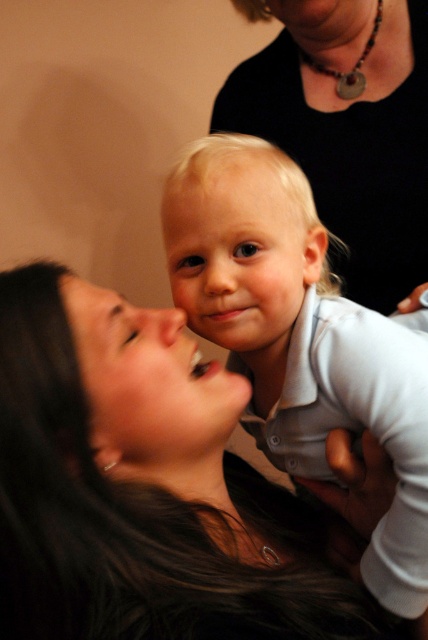
How far apart are blonde hair at center and black matte shirt at upper center?

blonde hair at center and black matte shirt at upper center are 14.57 inches apart from each other.

You are a GUI agent. You are given a task and a screenshot of the screen. Output one action in this format:
    pyautogui.click(x=<x>, y=<y>)
    Task: Click on the blonde hair at center
    The image size is (428, 640).
    Given the screenshot: What is the action you would take?
    pyautogui.click(x=300, y=337)

Who is more forward, [315,376] or [366,216]?

Point [315,376] is in front.

Where is `blonde hair at center`? Image resolution: width=428 pixels, height=640 pixels. blonde hair at center is located at coordinates (300, 337).

Can you confirm if smooth black hair at center is wider than black matte shirt at upper center?

Correct, the width of smooth black hair at center exceeds that of black matte shirt at upper center.

Who is positioned more to the left, smooth black hair at center or black matte shirt at upper center?

smooth black hair at center

Is point (259, 504) in front of point (247, 112)?

Yes, it is in front of point (247, 112).

At what (x,y) coordinates should I click in order to perform the action: click on smooth black hair at center. Please return your answer as a coordinate pair (x, y). The image size is (428, 640). Looking at the image, I should click on (143, 486).

Between smooth black hair at center and blonde hair at center, which one has more height?

blonde hair at center

Can you confirm if smooth black hair at center is positioned above blonde hair at center?

Actually, smooth black hair at center is below blonde hair at center.

Is point (29, 563) positioned before point (285, 460)?

Yes, it is in front of point (285, 460).

Where is `smooth black hair at center`? smooth black hair at center is located at coordinates (143, 486).